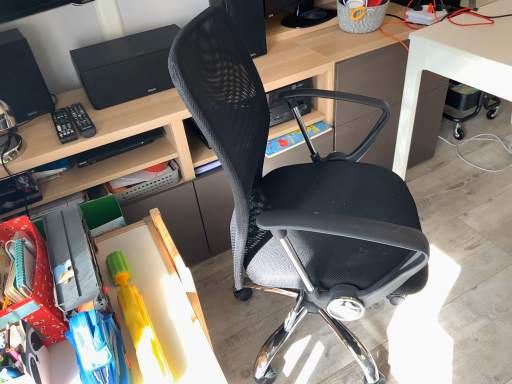
Question: Is matte plastic book at center inside black plastic remote control at left, marked as the second remote control in a left-to-right arrangement?

Choices:
 (A) no
 (B) yes

Answer: (A)

Question: Can you confirm if black plastic remote control at left, marked as the second remote control in a left-to-right arrangement, is bigger than matte plastic book at center?

Choices:
 (A) yes
 (B) no

Answer: (B)

Question: Is black plastic remote control at left, which is counted as the first remote control, starting from the right, facing away from matte plastic book at center?

Choices:
 (A) yes
 (B) no

Answer: (B)

Question: Is black plastic remote control at left, marked as the second remote control in a left-to-right arrangement, placed right next to matte plastic book at center?

Choices:
 (A) yes
 (B) no

Answer: (B)

Question: Considering the relative positions of black plastic remote control at left, which is counted as the first remote control, starting from the right, and matte plastic book at center in the image provided, is black plastic remote control at left, which is counted as the first remote control, starting from the right, to the right of matte plastic book at center from the viewer's perspective?

Choices:
 (A) no
 (B) yes

Answer: (A)

Question: Considering the relative positions of black plastic remote control at left, marked as the second remote control in a left-to-right arrangement, and matte plastic book at center in the image provided, is black plastic remote control at left, marked as the second remote control in a left-to-right arrangement, to the left of matte plastic book at center from the viewer's perspective?

Choices:
 (A) no
 (B) yes

Answer: (B)

Question: Could rubber yellow toy at lower left be considered to be inside wooden toy at lower left, acting as the 3th desk starting from the right?

Choices:
 (A) yes
 (B) no

Answer: (A)

Question: Does wooden toy at lower left, positioned as the first desk in left-to-right order, turn towards rubber yellow toy at lower left?

Choices:
 (A) yes
 (B) no

Answer: (B)

Question: Does wooden toy at lower left, positioned as the first desk in left-to-right order, have a greater width compared to rubber yellow toy at lower left?

Choices:
 (A) no
 (B) yes

Answer: (B)

Question: Is wooden toy at lower left, acting as the 3th desk starting from the right, closer to camera compared to rubber yellow toy at lower left?

Choices:
 (A) no
 (B) yes

Answer: (B)

Question: From the image's perspective, does wooden toy at lower left, acting as the 3th desk starting from the right, appear lower than rubber yellow toy at lower left?

Choices:
 (A) yes
 (B) no

Answer: (A)

Question: Is wooden toy at lower left, positioned as the first desk in left-to-right order, not inside rubber yellow toy at lower left?

Choices:
 (A) yes
 (B) no

Answer: (A)

Question: Considering the relative positions of matte plastic book at center and black plastic remote control at left, which is counted as the second remote control, starting from the right, in the image provided, is matte plastic book at center in front of black plastic remote control at left, which is counted as the second remote control, starting from the right,?

Choices:
 (A) yes
 (B) no

Answer: (B)